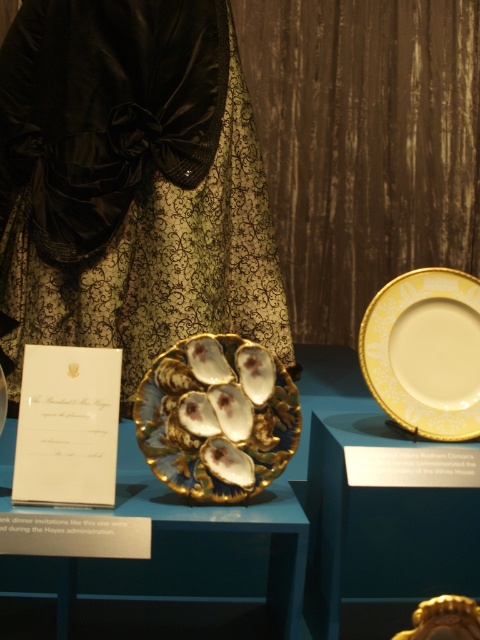
Measure the distance from black satin dress at center to gold metallic oyster shell at center.

black satin dress at center is 1.13 meters from gold metallic oyster shell at center.

Who is more forward, (11,381) or (239,493)?

Point (239,493) is in front.

Identify the location of black satin dress at center. (132, 182).

Does gold metallic oyster shell at center have a smaller size compared to gold/white porcelain plate at upper right?

Yes.

Which of these two, gold metallic oyster shell at center or gold/white porcelain plate at upper right, stands taller?

With more height is gold/white porcelain plate at upper right.

Does point (210, 458) lie in front of point (432, 376)?

Yes.

Find the location of a particular element. gold metallic oyster shell at center is located at coordinates (216, 417).

Can you confirm if black satin dress at center is positioned to the right of gold/white porcelain plate at upper right?

In fact, black satin dress at center is to the left of gold/white porcelain plate at upper right.

Consider the image. Does black satin dress at center have a greater height compared to gold/white porcelain plate at upper right?

Yes.

Based on the photo, who is more forward, (120, 275) or (415, 378)?

Positioned in front is point (415, 378).

The image size is (480, 640). I want to click on black satin dress at center, so (132, 182).